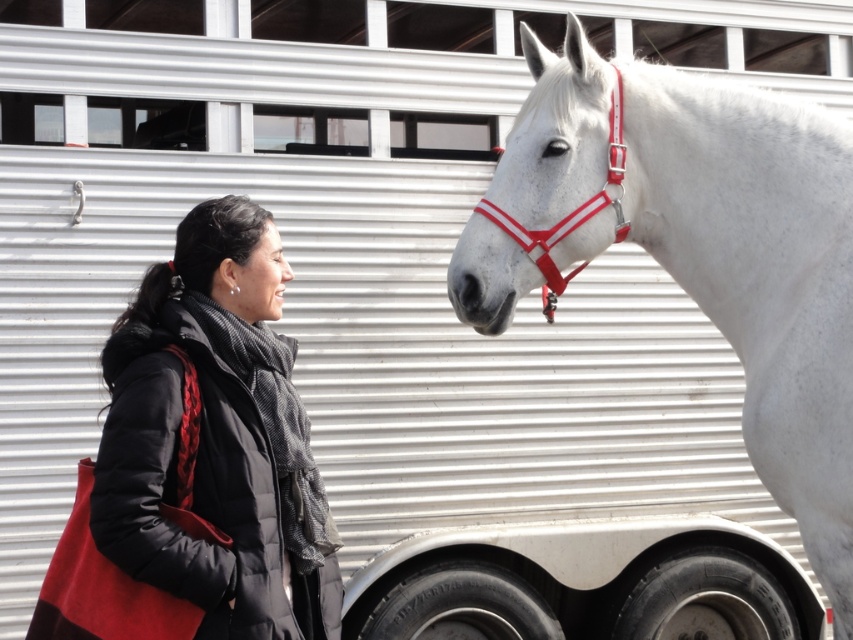
Which is more to the right, white glossy horse at center or shiny red plastic bridle at center?

white glossy horse at center

Is white glossy horse at center wider than shiny red plastic bridle at center?

Correct, the width of white glossy horse at center exceeds that of shiny red plastic bridle at center.

Identify the location of white glossy horse at center. The width and height of the screenshot is (853, 640). (755, 275).

Does black quilted jacket at left appear on the right side of shiny red plastic bridle at center?

Incorrect, black quilted jacket at left is not on the right side of shiny red plastic bridle at center.

Is point (241, 532) farther from camera compared to point (614, 179)?

No, (241, 532) is closer to viewer.

Describe the element at coordinates (218, 436) in the screenshot. I see `black quilted jacket at left` at that location.

Where is `black quilted jacket at left`? This screenshot has height=640, width=853. black quilted jacket at left is located at coordinates (218, 436).

Does point (577, 131) come farther from viewer compared to point (271, 621)?

Yes, it is.

Between white glossy horse at center and black quilted jacket at left, which one has more height?

With more height is white glossy horse at center.

Does point (693, 177) come in front of point (300, 426)?

No, it is not.

Locate an element on the screen. The image size is (853, 640). white glossy horse at center is located at coordinates (755, 275).